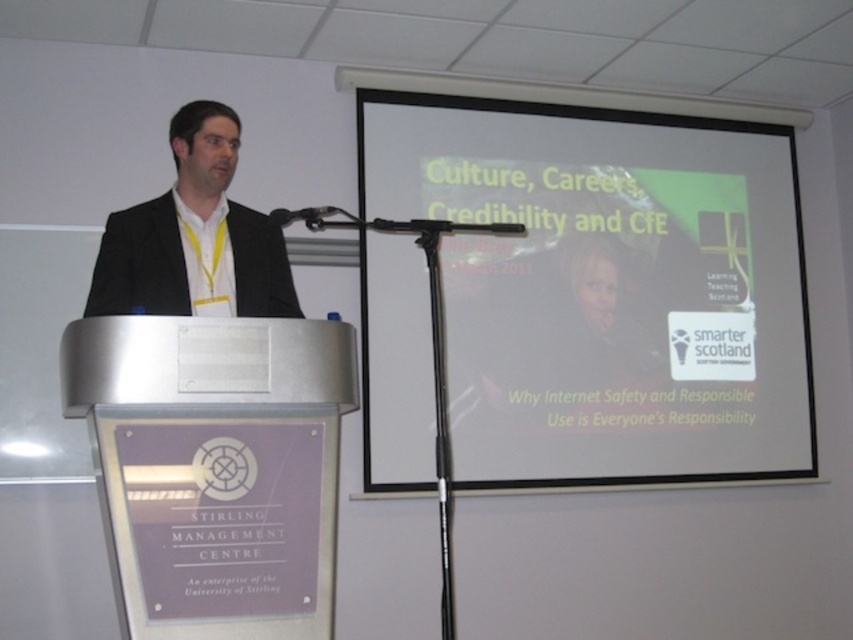
You are attending a presentation at the University of Stirling and notice two points marked on the screen. The first point is labeled as point at position (192, 131) and the second is point at position (273, 211). From the speaker at the podium, which point is closer to the front of the room?

Point at position (192, 131) is in front of point at position (273, 211), so the first point is closer to the front of the room.

You are an attendee in the conference room and want to take a photo of the speaker and the white matte projection screen at upper right. Since you want the black suit at left to also be visible in the photo, where should you position yourself to capture all three elements?

To capture the speaker, the white matte projection screen at upper right, and the black suit at left in the same photo, you should position yourself to the right side of the speaker. This way, the speaker will be centered, the projection screen at upper right will be visible on the left side of the frame, and the black suit at left will be included on the right side of the frame.